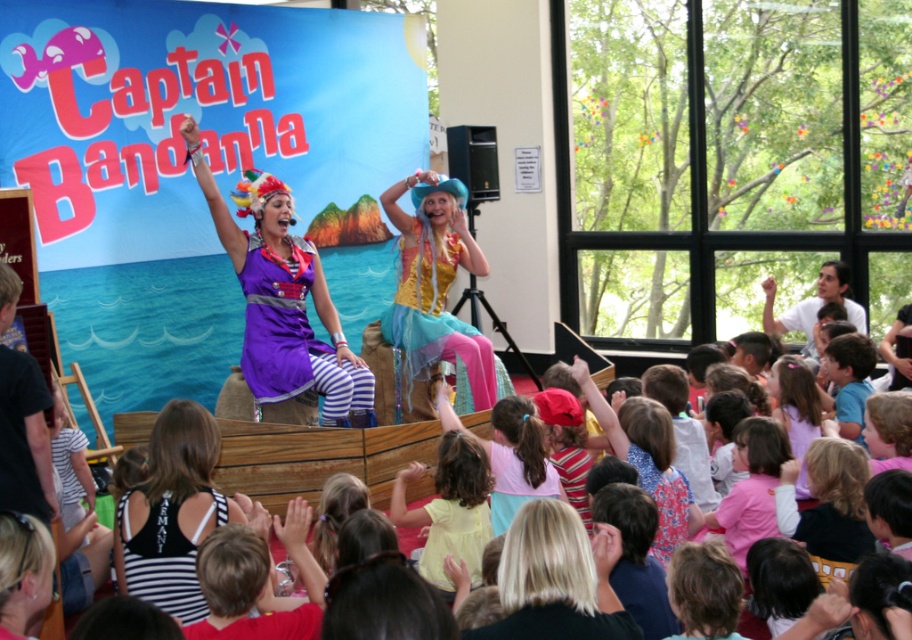
Question: Which point is farther to the camera?

Choices:
 (A) pink fabric dress at center
 (B) purple satin dress at center

Answer: (B)

Question: Is blonde hair at center above pink fabric dress at center?

Choices:
 (A) no
 (B) yes

Answer: (A)

Question: Can you confirm if purple satin dress at center is positioned to the right of smooth white shirt at upper right?

Choices:
 (A) yes
 (B) no

Answer: (B)

Question: Which is farther from the black striped tank top at lower left?

Choices:
 (A) yellow matte dress at center
 (B) purple satin dress at center
 (C) pink fabric dress at center

Answer: (B)

Question: Which point is farther to the camera?

Choices:
 (A) blonde hair at center
 (B) yellow matte dress at center
 (C) pink fabric dress at center

Answer: (C)

Question: Can you confirm if blonde hair at center is positioned below pink fabric dress at center?

Choices:
 (A) no
 (B) yes

Answer: (B)